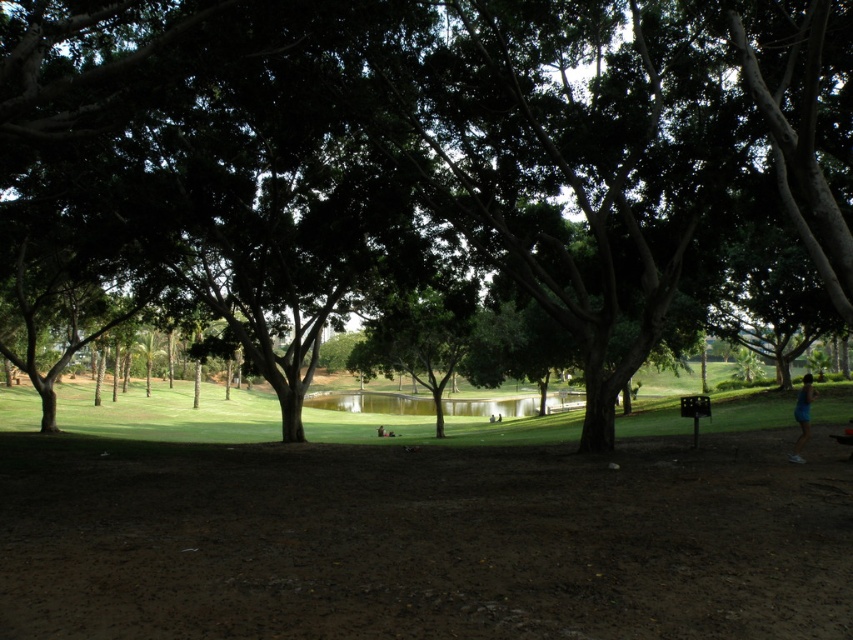
Based on the photo, you are a park visitor standing at the edge of the green smooth water at center. You want to take a photo of the green leafy tree at center without any obstructions. Can you see the entire tree in your viewfinder without moving your position?

The green leafy tree at center is in front of the green smooth water at center, so you cannot see the entire tree in your viewfinder without moving your position because part of it is blocked by the water.

You are standing in the park and want to walk from your current position to the blue fabric shorts at lower right. Which direction should you move relative to the green smooth water at center?

You should move away from the green smooth water at center towards the blue fabric shorts at lower right because the blue fabric shorts at lower right are closer to you than the green smooth water at center.

You are standing at the entrance of the park and want to reach the green leafy tree at center. According to the coordinates provided, in which direction should you walk from your current position to reach the tree?

The green leafy tree at center is located at coordinates point (405,150). Since you are at the entrance, which is typically at the edge of the park, you should walk towards the center of the park to reach the tree.